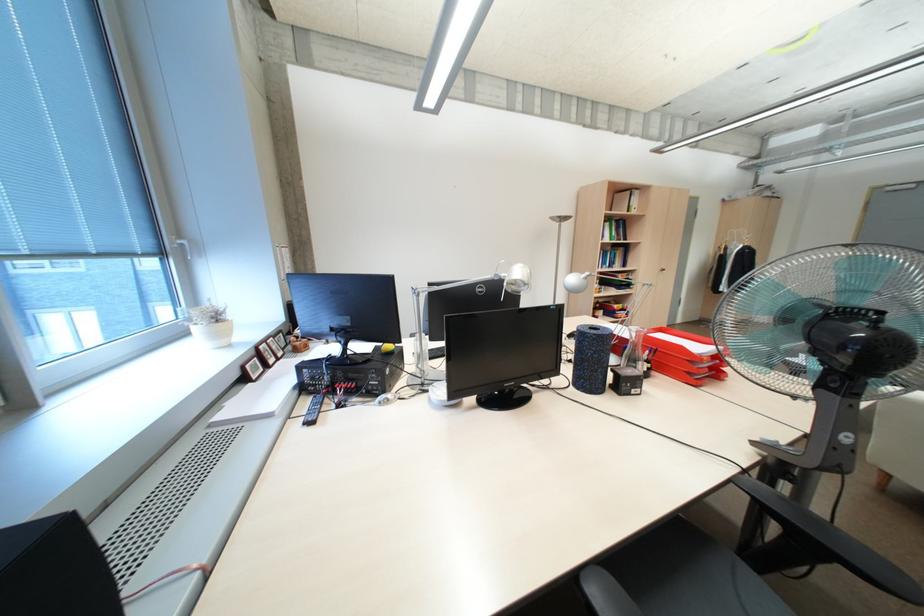
At what (x,y) coordinates should I click in order to perform the action: click on black fan dial. Please return your answer as a coordinate pair (x, y). Image resolution: width=924 pixels, height=616 pixels. Looking at the image, I should click on (783, 440).